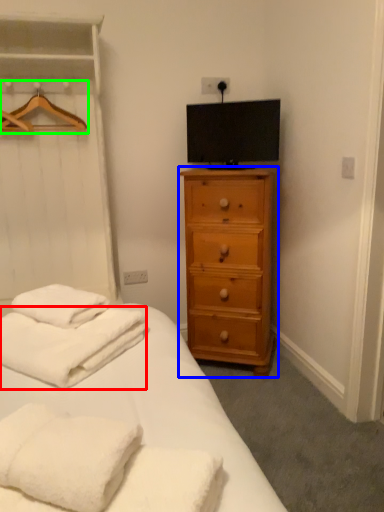
Question: Considering the real-world distances, which object is closest to bath towel (highlighted by a red box)? chest of drawers (highlighted by a blue box) or hanger (highlighted by a green box).

Choices:
 (A) chest of drawers
 (B) hanger

Answer: (A)